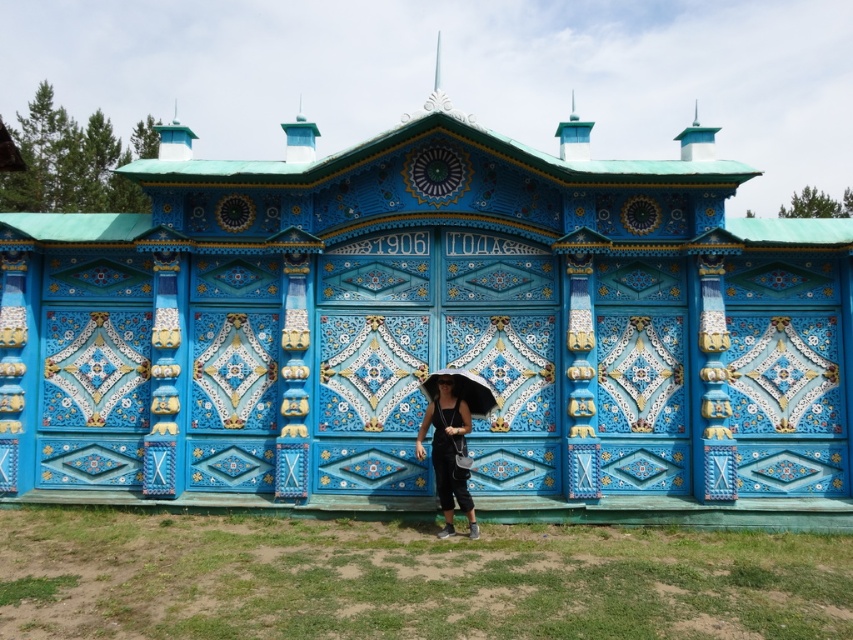
Question: Which object appears closest to the camera in this image?

Choices:
 (A) white matte umbrella at center
 (B) matte black hat at center

Answer: (B)

Question: Is matte black hat at center positioned at the back of white matte umbrella at center?

Choices:
 (A) no
 (B) yes

Answer: (A)

Question: From the image, what is the correct spatial relationship of matte black hat at center in relation to white matte umbrella at center?

Choices:
 (A) left
 (B) right

Answer: (A)

Question: Which object is closer to the camera taking this photo?

Choices:
 (A) white matte umbrella at center
 (B) matte black hat at center

Answer: (B)

Question: In this image, where is matte black hat at center located relative to white matte umbrella at center?

Choices:
 (A) above
 (B) below

Answer: (B)